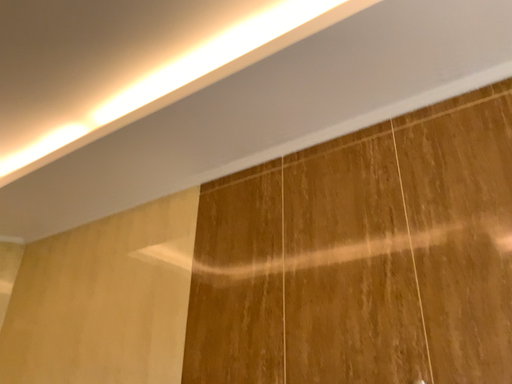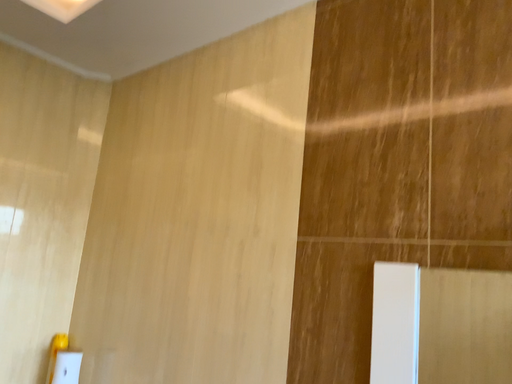
Question: How did the camera likely rotate when shooting the video?

Choices:
 (A) rotated left
 (B) rotated right

Answer: (A)